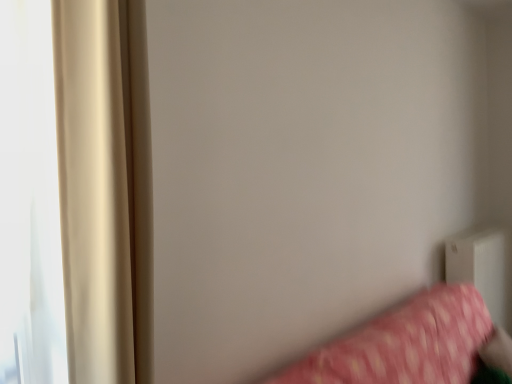
What is the approximate height of white plastic radiator at lower right?

white plastic radiator at lower right is 35.12 inches in height.

What is the approximate width of white plastic radiator at lower right?

white plastic radiator at lower right is 10.38 inches wide.

Image resolution: width=512 pixels, height=384 pixels. Describe the element at coordinates (105, 188) in the screenshot. I see `beige satin curtain at left` at that location.

Where is `pink fabric bed at lower right`? The height and width of the screenshot is (384, 512). pink fabric bed at lower right is located at coordinates [x=408, y=345].

In the image, is white plastic radiator at lower right positioned in front of or behind beige satin curtain at left?

Clearly, white plastic radiator at lower right is behind beige satin curtain at left.

Which is behind, point (467, 278) or point (125, 5)?

Point (467, 278)

Is white plastic radiator at lower right directly adjacent to beige satin curtain at left?

No, white plastic radiator at lower right is not next to beige satin curtain at left.

Which object is positioned more to the right, white plastic radiator at lower right or beige satin curtain at left?

From the viewer's perspective, white plastic radiator at lower right appears more on the right side.

From a real-world perspective, is beige satin curtain at left physically above white plastic radiator at lower right?

Yes, from a real-world perspective, beige satin curtain at left is over white plastic radiator at lower right

Considering the points (93, 90) and (490, 309), which point is in front, point (93, 90) or point (490, 309)?

The point (93, 90) is closer to the camera.

Can you see beige satin curtain at left touching white plastic radiator at lower right?

No, beige satin curtain at left is not beside white plastic radiator at lower right.

From the picture: Is the depth of beige satin curtain at left greater than that of white plastic radiator at lower right?

No, the depth of beige satin curtain at left is less than that of white plastic radiator at lower right.

Is white plastic radiator at lower right not inside pink fabric bed at lower right?

Indeed, white plastic radiator at lower right is completely outside pink fabric bed at lower right.

Considering the sizes of objects white plastic radiator at lower right and pink fabric bed at lower right in the image provided, who is thinner, white plastic radiator at lower right or pink fabric bed at lower right?

white plastic radiator at lower right.

Does white plastic radiator at lower right have a smaller size compared to pink fabric bed at lower right?

Indeed, white plastic radiator at lower right has a smaller size compared to pink fabric bed at lower right.

Between white plastic radiator at lower right and pink fabric bed at lower right, which one has more height?

white plastic radiator at lower right.

Can you confirm if pink fabric bed at lower right is shorter than beige satin curtain at left?

Indeed, pink fabric bed at lower right has a lesser height compared to beige satin curtain at left.

Relative to beige satin curtain at left, is pink fabric bed at lower right in front or behind?

In the image, pink fabric bed at lower right appears behind beige satin curtain at left.

From the image's perspective, which one is positioned higher, pink fabric bed at lower right or white plastic radiator at lower right?

white plastic radiator at lower right.

Which is in front, pink fabric bed at lower right or white plastic radiator at lower right?

pink fabric bed at lower right is more forward.

Which is closer to the camera, (449, 360) or (490, 236)?

Point (449, 360)

Which of these two, pink fabric bed at lower right or white plastic radiator at lower right, stands shorter?

With less height is pink fabric bed at lower right.

Considering the relative positions of beige satin curtain at left and pink fabric bed at lower right in the image provided, is beige satin curtain at left to the left of pink fabric bed at lower right from the viewer's perspective?

Yes.

Considering the sizes of objects beige satin curtain at left and pink fabric bed at lower right in the image provided, who is shorter, beige satin curtain at left or pink fabric bed at lower right?

pink fabric bed at lower right.

Where is `radiator on the right of the beige satin curtain at left`? Image resolution: width=512 pixels, height=384 pixels. radiator on the right of the beige satin curtain at left is located at coordinates (482, 267).

Where is `radiator located behind the beige satin curtain at left`? The height and width of the screenshot is (384, 512). radiator located behind the beige satin curtain at left is located at coordinates (482, 267).

Estimate the real-world distances between objects in this image. Which object is closer to beige satin curtain at left, pink fabric bed at lower right or white plastic radiator at lower right?

Based on the image, pink fabric bed at lower right appears to be nearer to beige satin curtain at left.

Looking at the image, which one is located closer to white plastic radiator at lower right, beige satin curtain at left or pink fabric bed at lower right?

pink fabric bed at lower right is positioned closer to the anchor white plastic radiator at lower right.

In the scene shown: Considering their positions, is pink fabric bed at lower right positioned closer to white plastic radiator at lower right than beige satin curtain at left?

The object closer to white plastic radiator at lower right is pink fabric bed at lower right.

From the image, which object appears to be nearer to beige satin curtain at left, white plastic radiator at lower right or pink fabric bed at lower right?

pink fabric bed at lower right is positioned closer to the anchor beige satin curtain at left.

Considering their positions, is white plastic radiator at lower right positioned closer to pink fabric bed at lower right than beige satin curtain at left?

white plastic radiator at lower right lies closer to pink fabric bed at lower right than the other object.

From the image, which object appears to be nearer to pink fabric bed at lower right, beige satin curtain at left or white plastic radiator at lower right?

Among the two, white plastic radiator at lower right is located nearer to pink fabric bed at lower right.

This screenshot has height=384, width=512. In order to click on furniture positioned between beige satin curtain at left and white plastic radiator at lower right from near to far in this screenshot , I will do `click(408, 345)`.